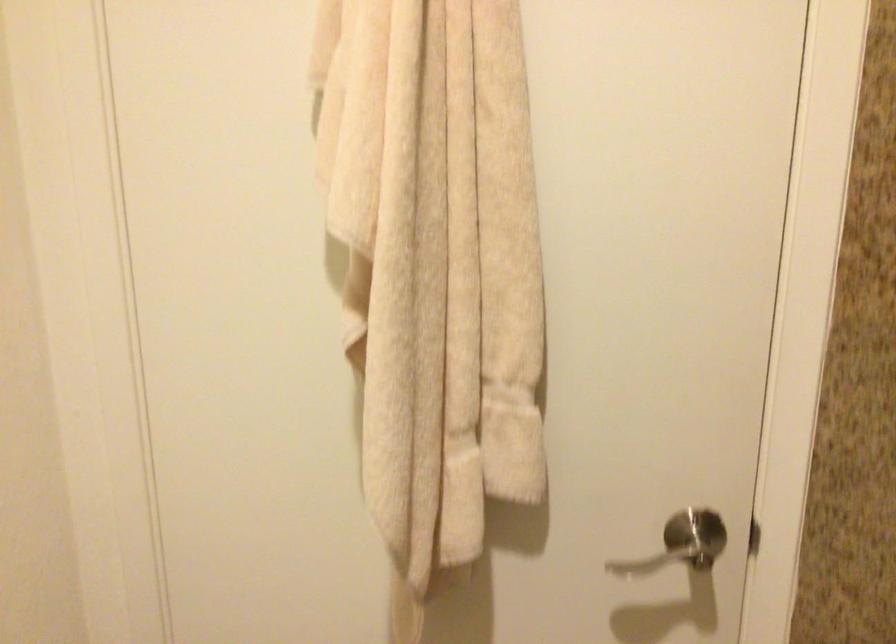
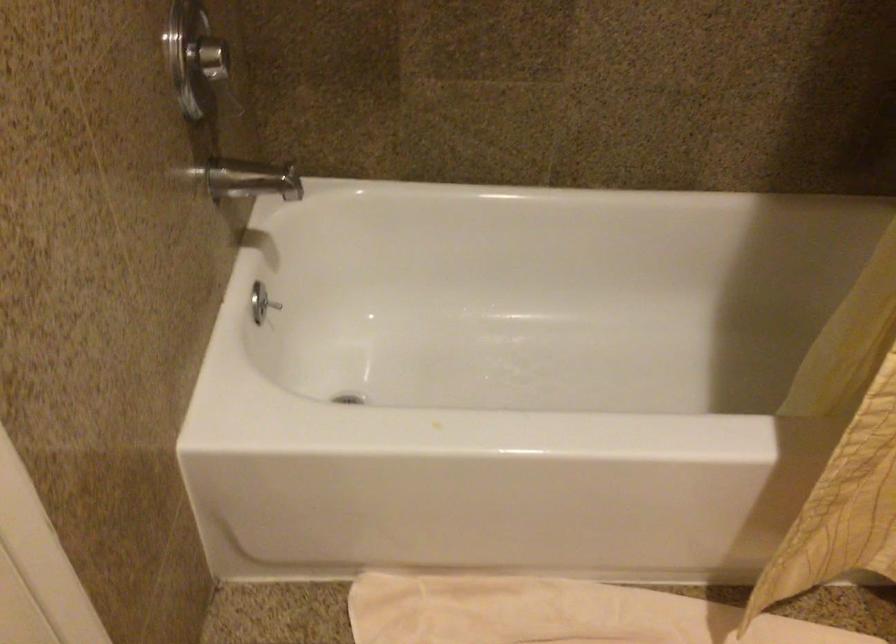
Based on the continuous images, in which direction is the camera rotating?

The camera rotated toward right-down.